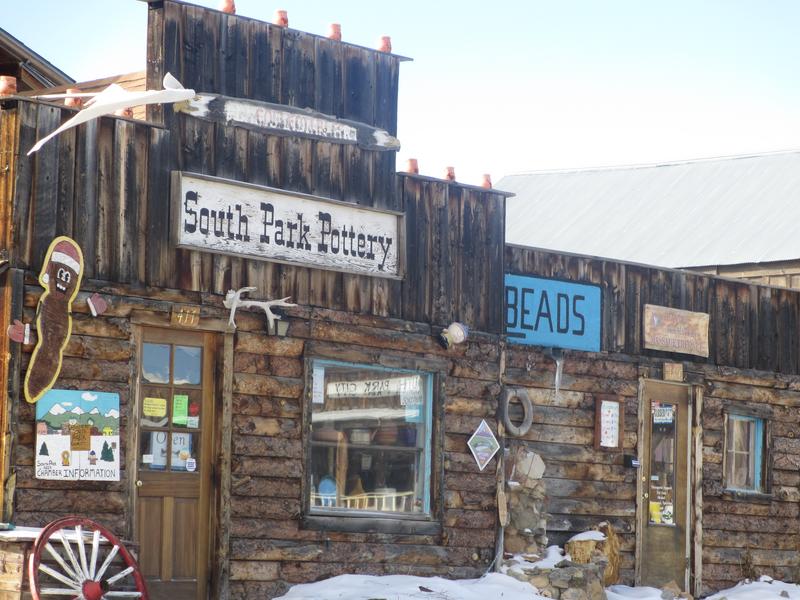
At what (x,y) coordinates should I click in order to perform the action: click on window. Please return your answer as a coordinate pair (x, y). Image resolution: width=800 pixels, height=600 pixels. Looking at the image, I should click on tap(361, 434).